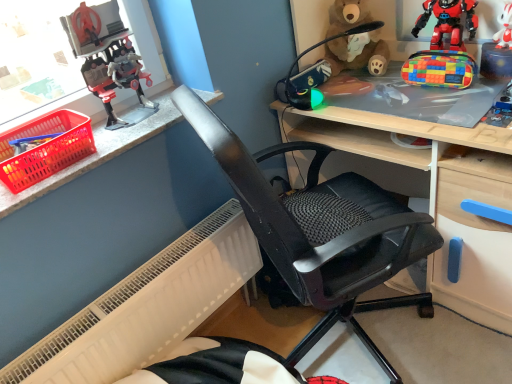
This screenshot has width=512, height=384. What are the coordinates of `free spot below plastic robot at upper left, which is the fifth toy in right-to-left order (from a real-world perspective)` in the screenshot? It's located at (139, 118).